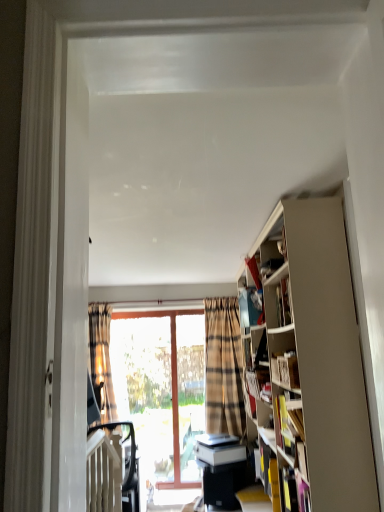
Question: Considering the relative sizes of clear glass screen door at center and black plastic swivel chair at lower left in the image provided, is clear glass screen door at center wider than black plastic swivel chair at lower left?

Choices:
 (A) no
 (B) yes

Answer: (A)

Question: Can you confirm if clear glass screen door at center is thinner than black plastic swivel chair at lower left?

Choices:
 (A) yes
 (B) no

Answer: (A)

Question: From a real-world perspective, is clear glass screen door at center on black plastic swivel chair at lower left?

Choices:
 (A) no
 (B) yes

Answer: (B)

Question: Does clear glass screen door at center lie behind black plastic swivel chair at lower left?

Choices:
 (A) no
 (B) yes

Answer: (B)

Question: From a real-world perspective, is clear glass screen door at center located beneath black plastic swivel chair at lower left?

Choices:
 (A) yes
 (B) no

Answer: (B)

Question: Could you tell me if clear glass screen door at center is facing black plastic swivel chair at lower left?

Choices:
 (A) yes
 (B) no

Answer: (B)

Question: Is white matte bookshelf at right, placed as the first book when sorted from front to back, oriented away from clear glass screen door at center?

Choices:
 (A) no
 (B) yes

Answer: (A)

Question: From the image's perspective, does white matte bookshelf at right, which is counted as the 2th book, starting from the bottom, appear higher than clear glass screen door at center?

Choices:
 (A) no
 (B) yes

Answer: (B)

Question: Is clear glass screen door at center located within white matte bookshelf at right, which is counted as the 2th book, starting from the bottom?

Choices:
 (A) yes
 (B) no

Answer: (B)

Question: Is white matte bookshelf at right, the first book in the top-to-bottom sequence, further to the viewer compared to clear glass screen door at center?

Choices:
 (A) yes
 (B) no

Answer: (B)

Question: Considering the relative sizes of white matte bookshelf at right, placed as the first book when sorted from front to back, and clear glass screen door at center in the image provided, is white matte bookshelf at right, placed as the first book when sorted from front to back, thinner than clear glass screen door at center?

Choices:
 (A) yes
 (B) no

Answer: (A)

Question: Is white matte bookshelf at right, placed as the first book when sorted from front to back, far away from clear glass screen door at center?

Choices:
 (A) no
 (B) yes

Answer: (B)

Question: From a real-world perspective, is plaid fabric curtain at left physically below black glossy table at lower center?

Choices:
 (A) no
 (B) yes

Answer: (A)